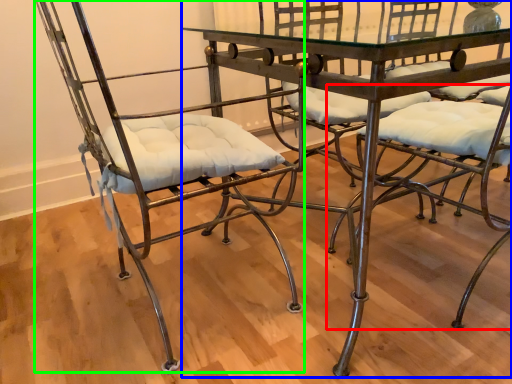
Question: Which is nearer to the chair (highlighted by a red box)? table (highlighted by a blue box) or chair (highlighted by a green box).

Choices:
 (A) table
 (B) chair

Answer: (A)